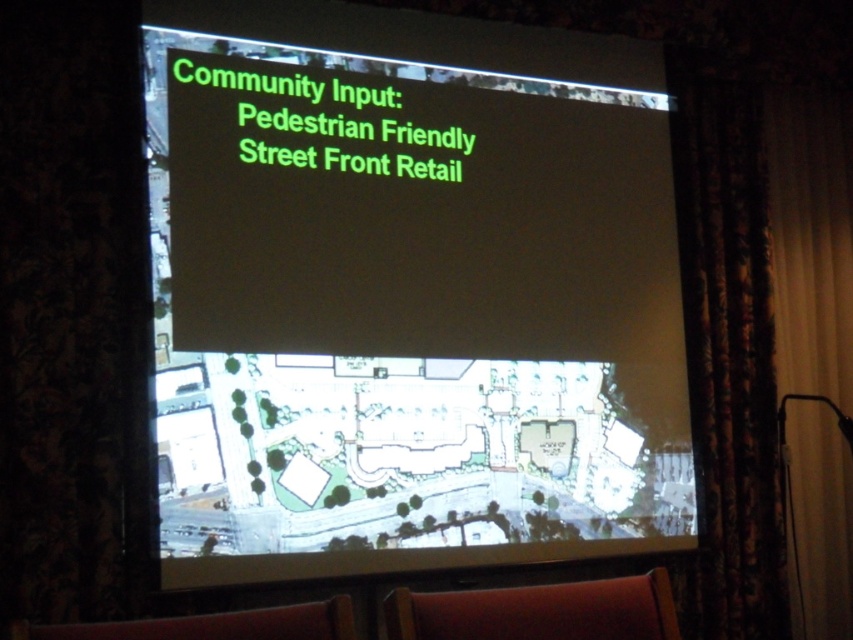
Which is behind, point (538, 256) or point (397, 625)?

Point (538, 256)

Which is in front, point (374, 196) or point (601, 630)?

Point (601, 630) is more forward.

At what (x,y) coordinates should I click in order to perform the action: click on white paper at center. Please return your answer as a coordinate pair (x, y). Looking at the image, I should click on (409, 292).

Between white paper at center and brown leather armchair at lower center, which one is positioned lower?

brown leather armchair at lower center

Looking at this image, is white paper at center above brown leather armchair at lower center?

Yes, white paper at center is above brown leather armchair at lower center.

Who is more distant from viewer, (338, 172) or (149, 632)?

The point (338, 172) is behind.

Find the location of a particular element. white paper at center is located at coordinates (409, 292).

Between dark floral fabric curtain at right and red leather armchair at lower center, which one has less height?

With less height is red leather armchair at lower center.

Between dark floral fabric curtain at right and red leather armchair at lower center, which one is positioned higher?

Positioned higher is dark floral fabric curtain at right.

The height and width of the screenshot is (640, 853). In order to click on dark floral fabric curtain at right in this screenshot , I will do `click(726, 349)`.